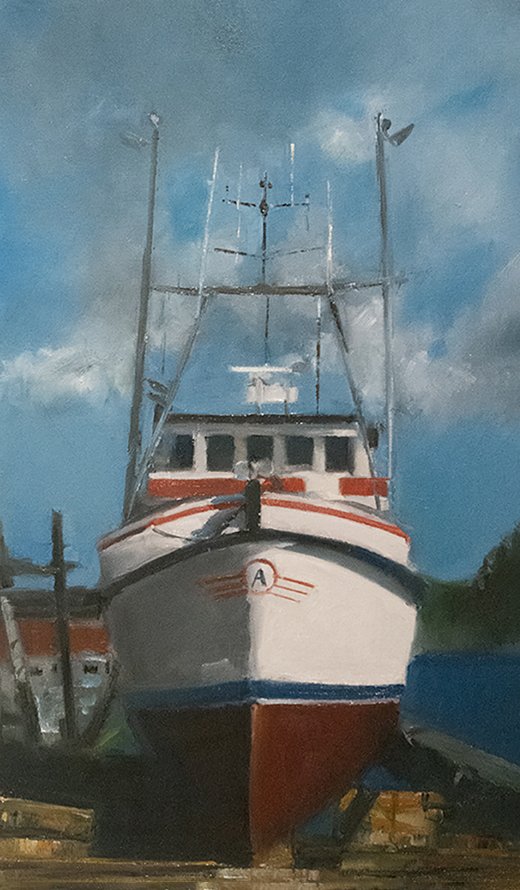
At what (x,y) coordinates should I click in order to perform the action: click on painting. Please return your answer as a coordinate pair (x, y). Image resolution: width=520 pixels, height=890 pixels. Looking at the image, I should click on (164, 506).